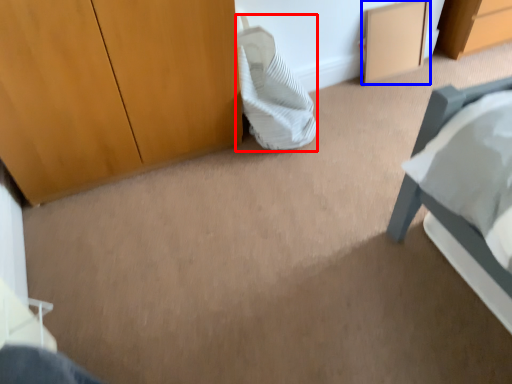
Question: Which object is closer to the camera taking this photo, pillow (highlighted by a red box) or cabinetry (highlighted by a blue box)?

Choices:
 (A) pillow
 (B) cabinetry

Answer: (A)